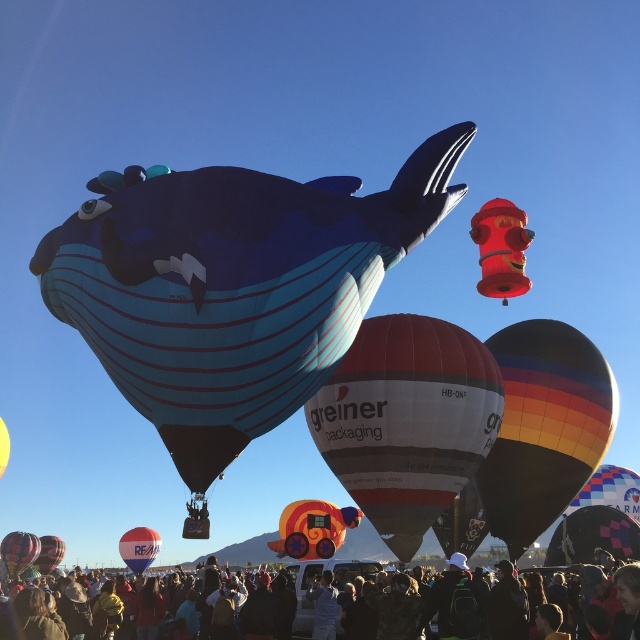
Question: Is white glossy hot air balloon at center smaller than red glossy balloon at center?

Choices:
 (A) yes
 (B) no

Answer: (B)

Question: Among these points, which one is nearest to the camera?

Choices:
 (A) (54, 536)
 (B) (4, 545)

Answer: (B)

Question: Is rainbow striped balloon at center to the left of orange fabric balloon at center from the viewer's perspective?

Choices:
 (A) yes
 (B) no

Answer: (B)

Question: Estimate the real-world distances between objects in this image. Which object is closer to the matte black hot air balloon at lower left?

Choices:
 (A) white glossy hot air balloon at center
 (B) dark blue fabric crowd at lower center
 (C) orange fabric balloon at center
 (D) rainbow striped balloon at center

Answer: (C)

Question: Is white glossy hot air balloon at center above dark blue fabric crowd at lower center?

Choices:
 (A) no
 (B) yes

Answer: (B)

Question: Which of the following is the farthest from the observer?

Choices:
 (A) pos(353,472)
 (B) pos(60,556)
 (C) pos(112,298)
 (D) pos(3,444)

Answer: (B)